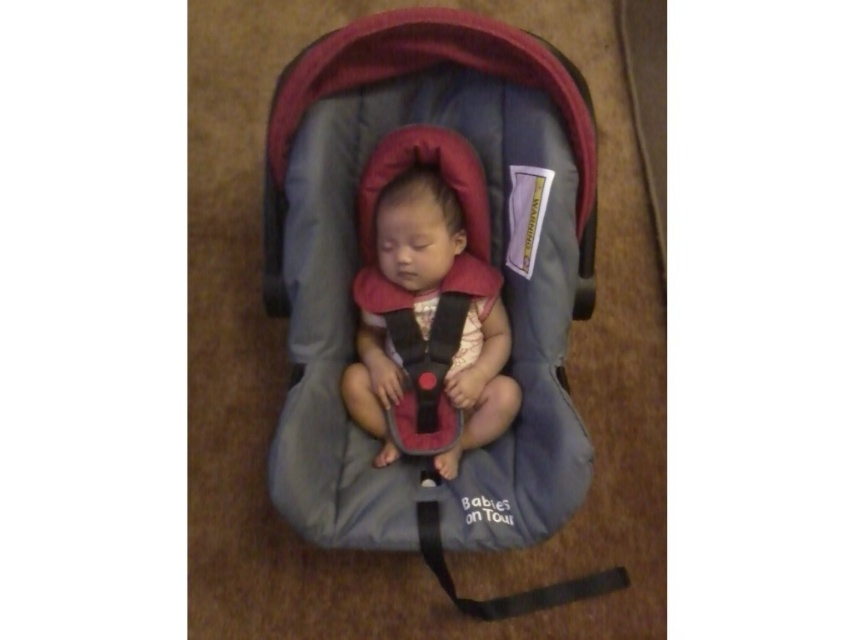
Question: Which point is closer to the camera?

Choices:
 (A) matte black baby carrier at center
 (B) black fabric strap at center

Answer: (A)

Question: Which object appears closest to the camera in this image?

Choices:
 (A) black fabric strap at center
 (B) gray fabric baby carriage at center

Answer: (B)

Question: Is gray fabric baby carriage at center thinner than matte black baby carrier at center?

Choices:
 (A) yes
 (B) no

Answer: (B)

Question: Is matte black baby carrier at center below black fabric strap at center?

Choices:
 (A) no
 (B) yes

Answer: (A)

Question: Does gray fabric baby carriage at center appear over matte black baby carrier at center?

Choices:
 (A) no
 (B) yes

Answer: (A)

Question: Considering the real-world distances, which object is closest to the gray fabric baby carriage at center?

Choices:
 (A) matte black baby carrier at center
 (B) black fabric strap at center

Answer: (A)